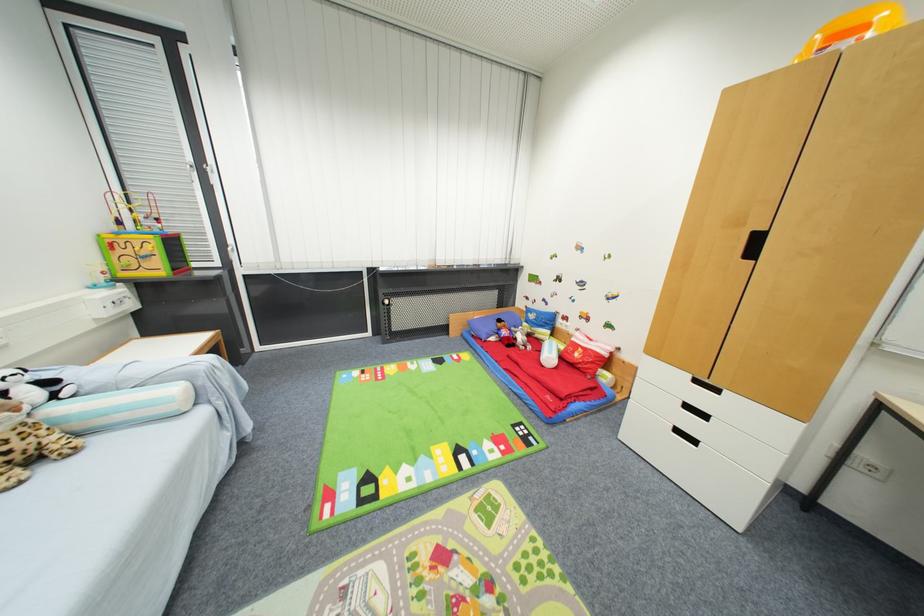
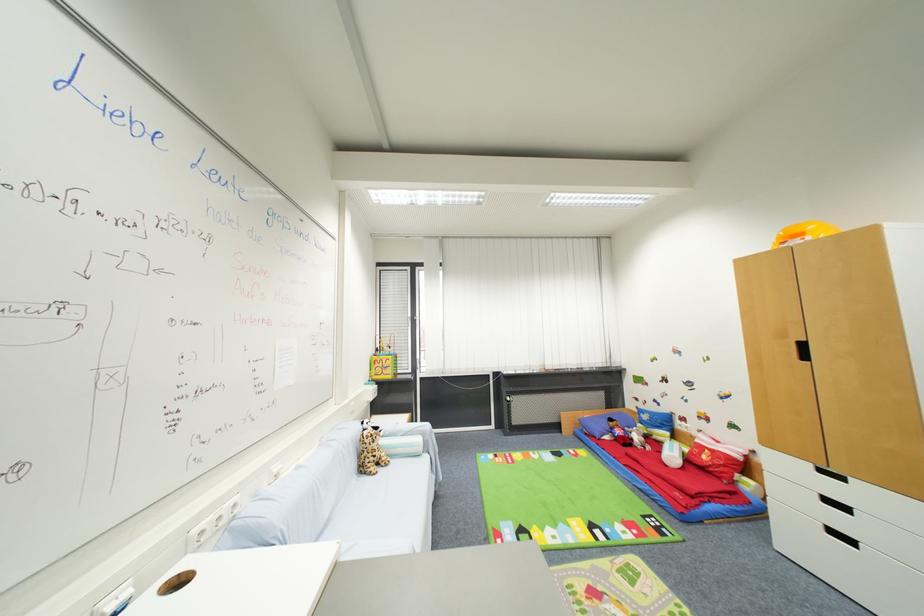
Where in the second image is the point corresponding to point 526,392 from the first image?

(650, 488)